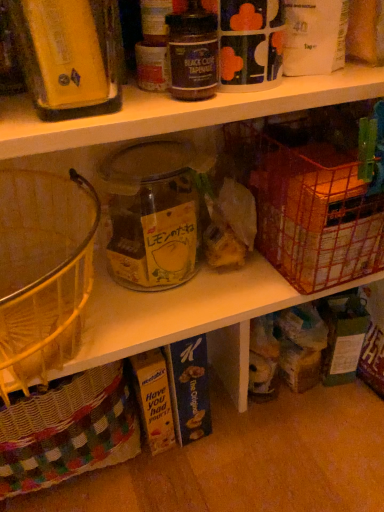
Question: Is metallic wire basket at right inside the boundaries of matte yellow container at upper left, the 1th bottle from the left, or outside?

Choices:
 (A) outside
 (B) inside

Answer: (A)

Question: Considering the positions of metallic wire basket at right and matte yellow container at upper left, the 1th bottle from the left, in the image, is metallic wire basket at right taller or shorter than matte yellow container at upper left, the 1th bottle from the left,?

Choices:
 (A) tall
 (B) short

Answer: (B)

Question: Which of these objects is positioned closest to the metallic wire basket at right?

Choices:
 (A) matte yellow container at upper left, the 1th bottle from the left
 (B) black glass jar at upper center, which ranks as the 2th bottle in left-to-right order
 (C) transparent glass jar at center

Answer: (C)

Question: Considering the real-world distances, which object is farthest from the transparent glass jar at center?

Choices:
 (A) metallic wire basket at right
 (B) black glass jar at upper center, which ranks as the 2th bottle in left-to-right order
 (C) matte yellow container at upper left, arranged as the 2th bottle when viewed from the right

Answer: (B)